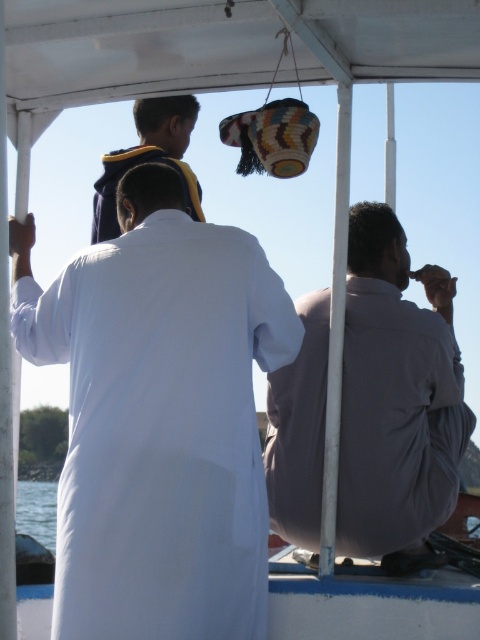
You are a passenger on the boat and want to place a small item on the white cloth at center. Where exactly should you place it?

The white cloth at center is located at coordinates point (158,417), so place the item there.